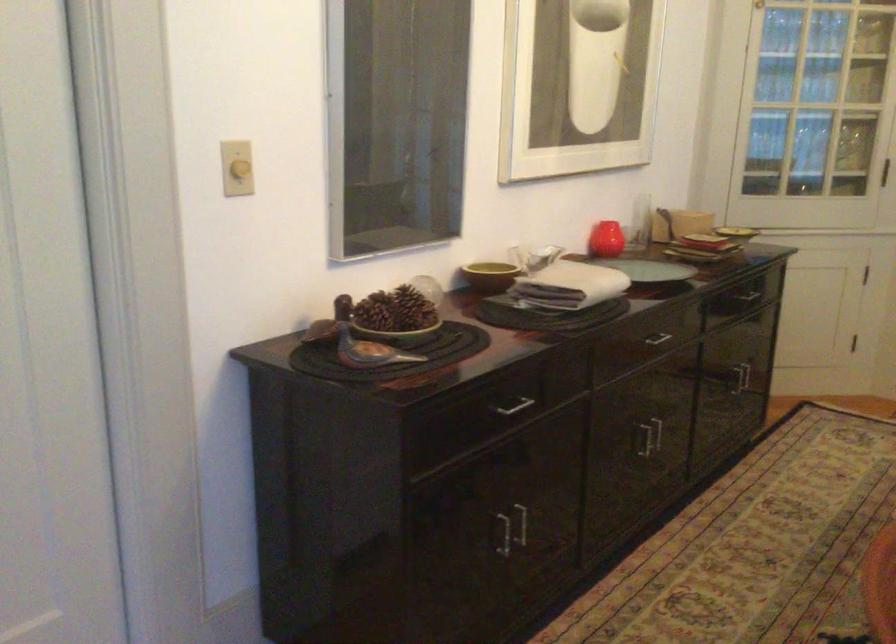
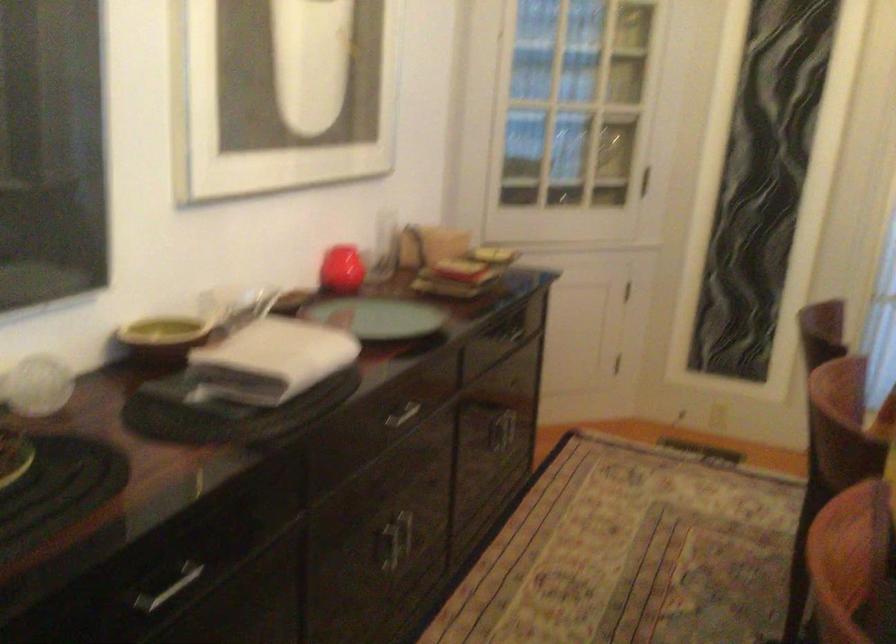
Question: What movement of the cameraman would produce the second image?

Choices:
 (A) Left
 (B) Right
 (C) Forward
 (D) Backward

Answer: (C)